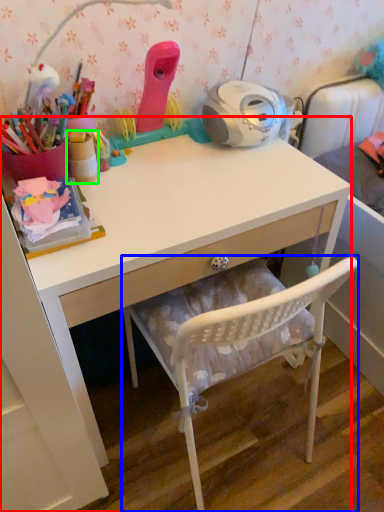
Question: Which object is the farthest from desk (highlighted by a red box)? Choose among these: chair (highlighted by a blue box) or stationery (highlighted by a green box).

Choices:
 (A) chair
 (B) stationery

Answer: (B)